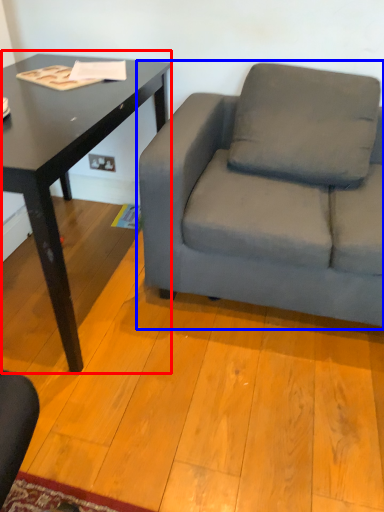
Question: Which of the following is the farthest to the observer, table (highlighted by a red box) or studio couch (highlighted by a blue box)?

Choices:
 (A) table
 (B) studio couch

Answer: (B)